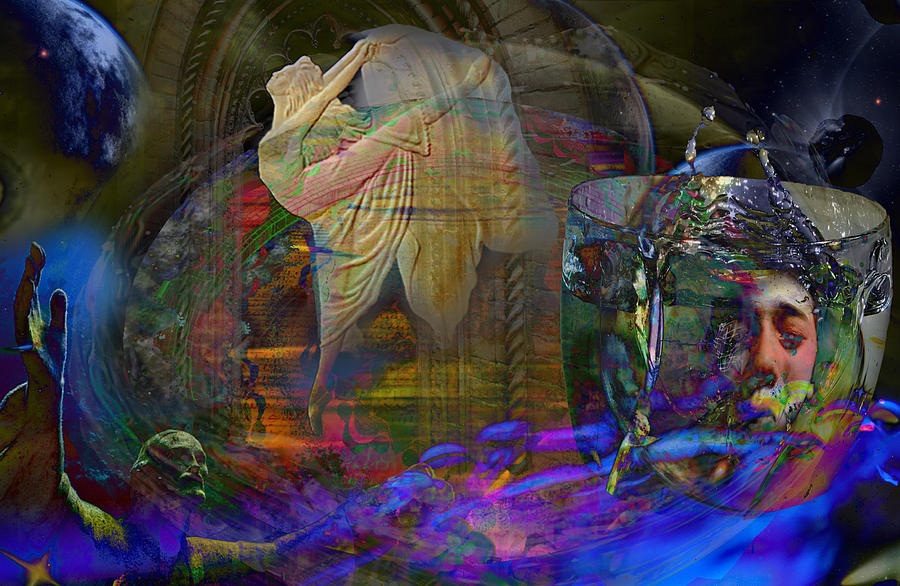
Identify the location of rim of cup. This screenshot has height=586, width=900. coord(570,196), coord(882,214), coord(731,175), coord(732,239).